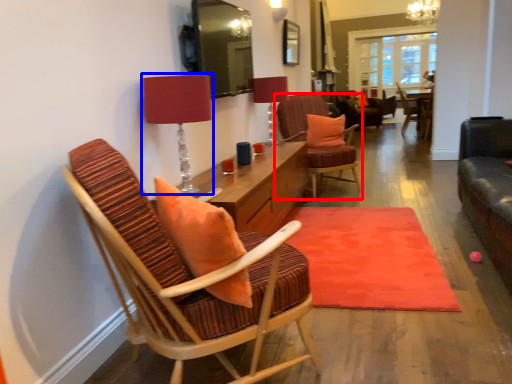
Question: Which object appears closest to the camera in this image, chair (highlighted by a red box) or table lamp (highlighted by a blue box)?

Choices:
 (A) chair
 (B) table lamp

Answer: (B)